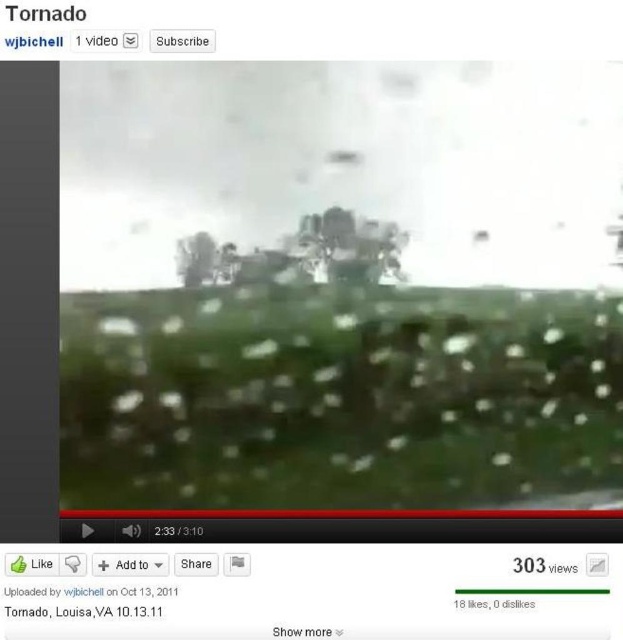
Which is more to the left, green leafy tree at center or transparent text at center?

transparent text at center

Which of these two, green leafy tree at center or transparent text at center, stands shorter?

With less height is transparent text at center.

Is point (391, 259) closer to camera compared to point (131, 604)?

No, it is behind (131, 604).

This screenshot has width=623, height=640. Find the location of `green leafy tree at center`. green leafy tree at center is located at coordinates (348, 246).